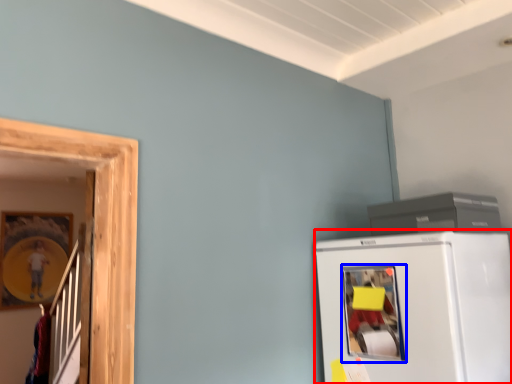
Question: Which point is further to the camera, refrigerator (highlighted by a red box) or window (highlighted by a blue box)?

Choices:
 (A) refrigerator
 (B) window

Answer: (B)